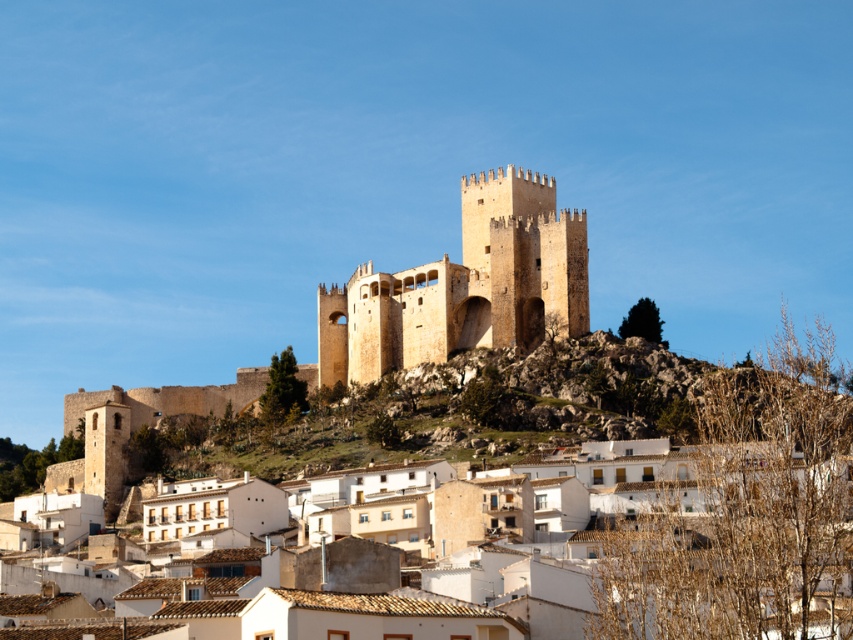
You are a tourist standing at the base of the castle hill. You see the white clay houses at center in the distance. If you want to take a photo of them, would you need to zoom in or zoom out your camera lens?

The white clay houses at center are 198.74 feet away from the camera. Since they are quite far, you would need to zoom in your camera lens to capture them clearly.

Based on the scene described, which object is taller between the golden stone castle at center and the light brown stone fort at center?

The golden stone castle at center is taller than the light brown stone fort at center according to the description provided.